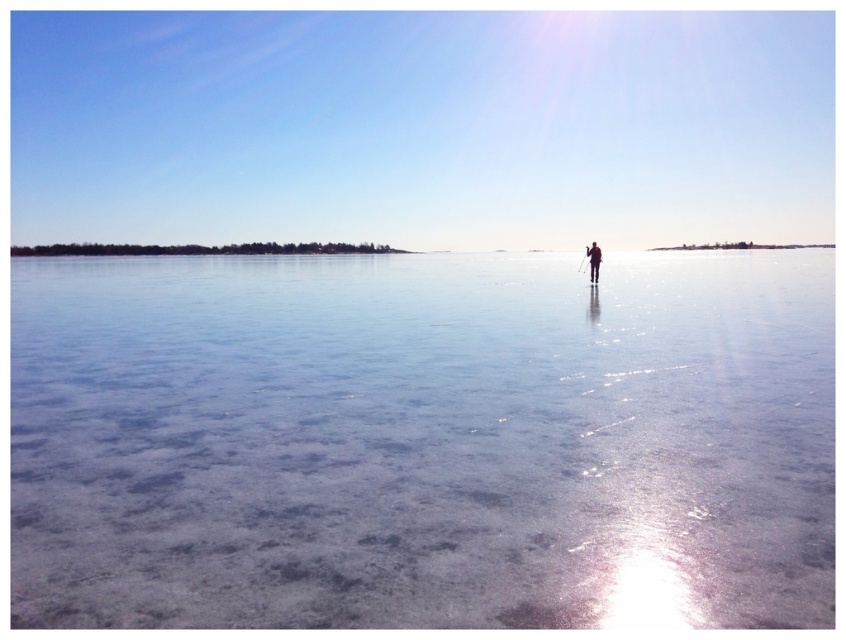
You are standing on the frozen landscape and want to reach the point at the top of the image. Which point should you walk towards, point at (x=323, y=611) or point at (x=591, y=273)?

You should walk towards point at (x=591, y=273) because it is further away from the camera and closer to the top of the image.